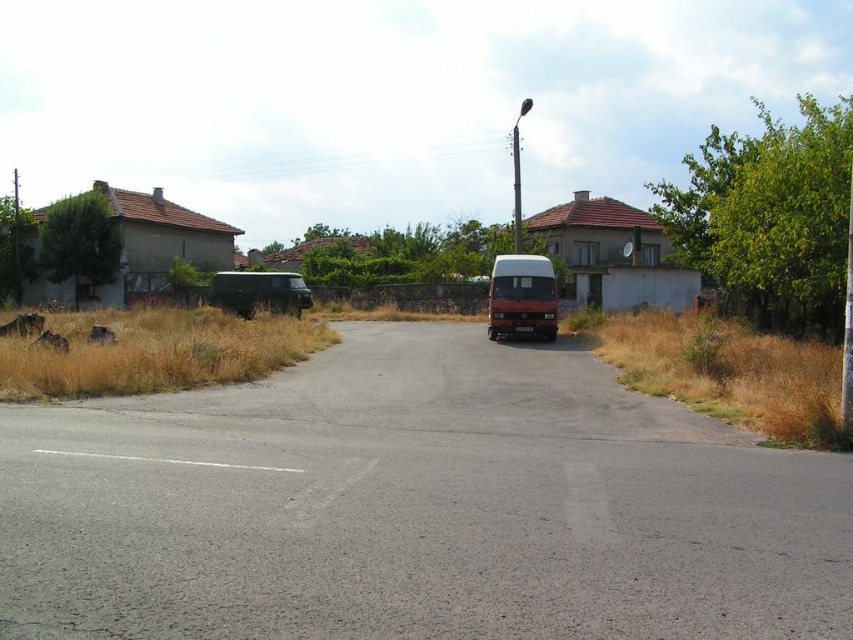
Who is more distant from viewer, (532,330) or (241,316)?

The point (241,316) is more distant.

Is point (511, 320) less distant than point (294, 298)?

Yes, point (511, 320) is in front of point (294, 298).

Which is behind, point (537, 260) or point (281, 282)?

The point (281, 282) is behind.

You are a GUI agent. You are given a task and a screenshot of the screen. Output one action in this format:
    pyautogui.click(x=<x>, y=<y>)
    Task: Click on the matte red van at center
    
    Given the screenshot: What is the action you would take?
    pyautogui.click(x=521, y=296)

Between point (514, 582) and point (537, 298), which one is positioned in front?

Point (514, 582)

Identify the location of black matte van at center. Image resolution: width=853 pixels, height=640 pixels. pyautogui.click(x=415, y=506).

Does black matte van at center come behind dark green matte van at left?

That is False.

Is point (694, 445) behind point (292, 284)?

No, (694, 445) is closer to viewer.

Which is in front, point (451, 429) or point (254, 308)?

Positioned in front is point (451, 429).

Locate an element on the screen. The height and width of the screenshot is (640, 853). black matte van at center is located at coordinates (415, 506).